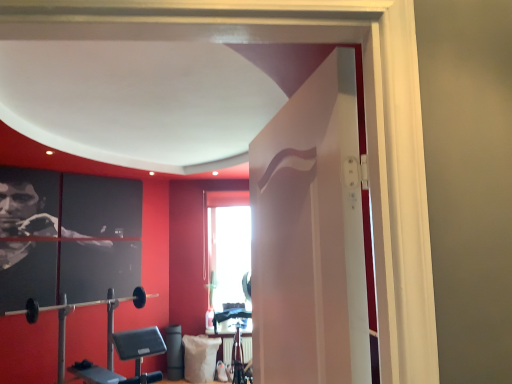
Question: Considering the relative sizes of white fabric pillow at lower center and black rubber barbell at lower left in the image provided, is white fabric pillow at lower center thinner than black rubber barbell at lower left?

Choices:
 (A) yes
 (B) no

Answer: (B)

Question: Can you confirm if white fabric pillow at lower center is bigger than black rubber barbell at lower left?

Choices:
 (A) yes
 (B) no

Answer: (B)

Question: Could you tell me if white fabric pillow at lower center is facing black rubber barbell at lower left?

Choices:
 (A) no
 (B) yes

Answer: (A)

Question: Is white fabric pillow at lower center not within black rubber barbell at lower left?

Choices:
 (A) no
 (B) yes

Answer: (B)

Question: From the image's perspective, does white fabric pillow at lower center appear higher than black rubber barbell at lower left?

Choices:
 (A) yes
 (B) no

Answer: (B)

Question: Is black rubber barbell at lower left surrounded by white fabric pillow at lower center?

Choices:
 (A) no
 (B) yes

Answer: (A)

Question: Does white glossy door at center have a lesser height compared to white fabric pillow at lower center?

Choices:
 (A) no
 (B) yes

Answer: (A)

Question: Is white glossy door at center positioned with its back to white fabric pillow at lower center?

Choices:
 (A) yes
 (B) no

Answer: (B)

Question: Is white glossy door at center facing towards white fabric pillow at lower center?

Choices:
 (A) no
 (B) yes

Answer: (A)

Question: Is the depth of white glossy door at center greater than that of white fabric pillow at lower center?

Choices:
 (A) yes
 (B) no

Answer: (B)

Question: Is white glossy door at center at the right side of white fabric pillow at lower center?

Choices:
 (A) no
 (B) yes

Answer: (B)

Question: Is the depth of white glossy door at center less than that of white fabric pillow at lower center?

Choices:
 (A) no
 (B) yes

Answer: (B)

Question: From a real-world perspective, is black rubber barbell at lower left below white fabric pillow at lower center?

Choices:
 (A) no
 (B) yes

Answer: (A)